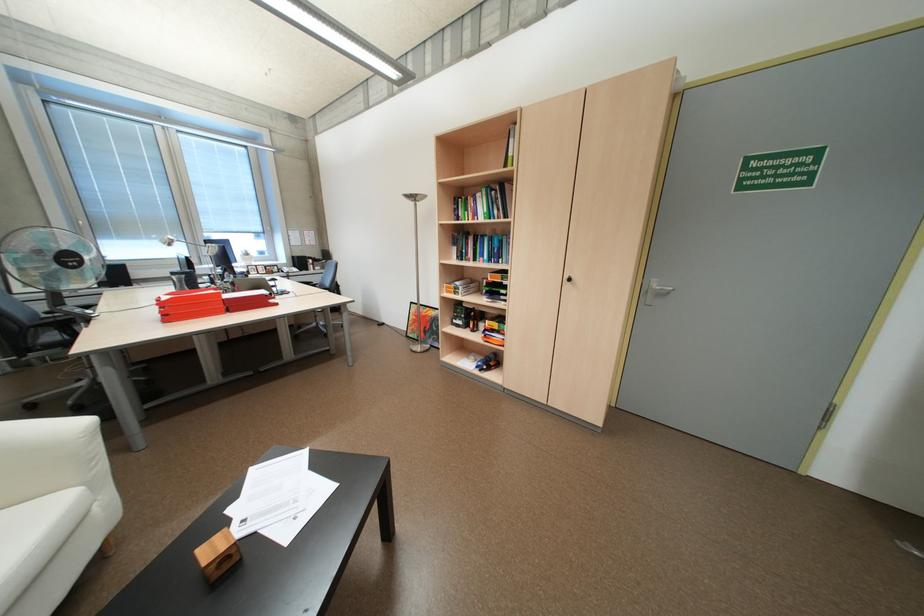
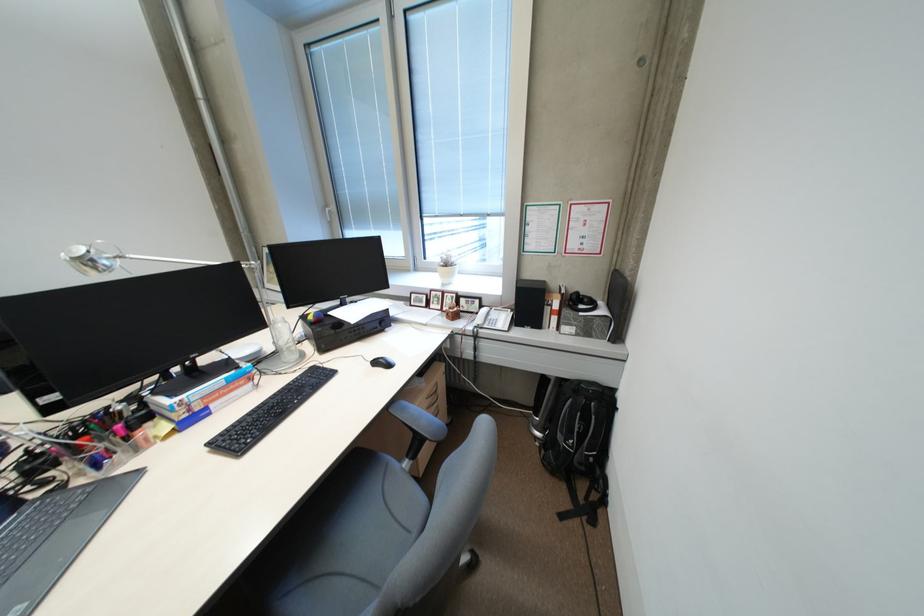
Where in the second image is the point corresponding to (310,262) from the first image?

(538, 302)